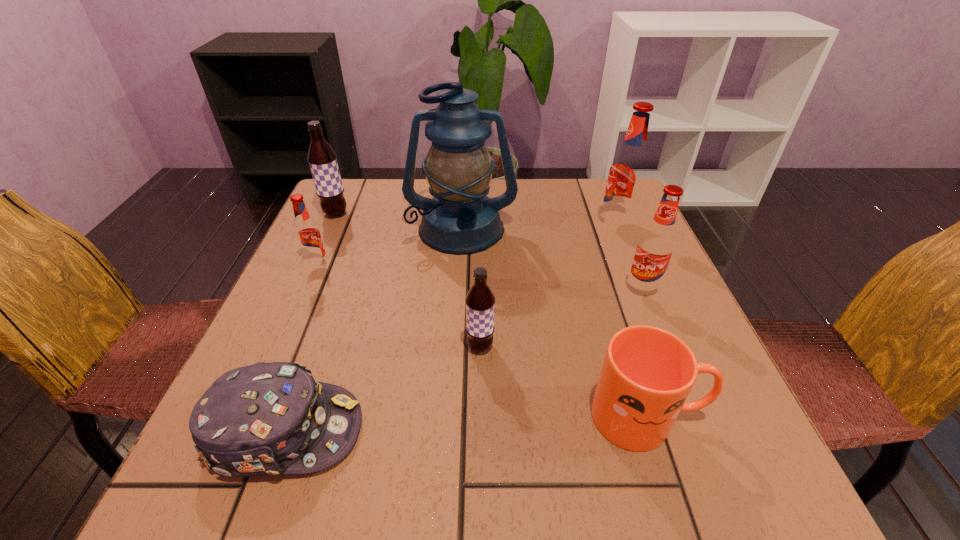
You are a GUI agent. You are given a task and a screenshot of the screen. Output one action in this format:
    pyautogui.click(x=<x>, y=<y>)
    Task: Click on the free space between the left brown root beer and the second smallest red root beer
    The image size is (960, 540).
    Given the screenshot: What is the action you would take?
    pyautogui.click(x=489, y=252)

Identify the location of free space between the lantern and the second nearest red root beer. Image resolution: width=960 pixels, height=540 pixels. (390, 248).

Where is `free area in between the blue lantern and the headwear`? free area in between the blue lantern and the headwear is located at coordinates (373, 330).

In order to click on free space between the orange mug and the lantern in this screenshot , I will do `click(554, 322)`.

Find the location of `free space between the bigger brown root beer and the fourth farthest object`. free space between the bigger brown root beer and the fourth farthest object is located at coordinates (326, 241).

The width and height of the screenshot is (960, 540). Identify the location of vacant space that's between the blue lantern and the fifth nearest object. (390, 248).

Select which object is the seventh closest to the leftmost red root beer. Please provide its 2D coordinates. Your answer should be formatted as a tuple, i.e. [(x, y)], where the tuple contains the x and y coordinates of a point satisfying the conditions above.

[(656, 245)]

Choose which object is the nearest neighbor to the second farthest red root beer. Please provide its 2D coordinates. Your answer should be formatted as a tuple, i.e. [(x, y)], where the tuple contains the x and y coordinates of a point satisfying the conditions above.

[(460, 219)]

Identify which root beer is the fourth closest to the second farthest red root beer. Please provide its 2D coordinates. Your answer should be formatted as a tuple, i.e. [(x, y)], where the tuple contains the x and y coordinates of a point satisfying the conditions above.

[(656, 245)]

In order to click on root beer that is the closest to the right brown root beer in this screenshot , I will do `click(656, 245)`.